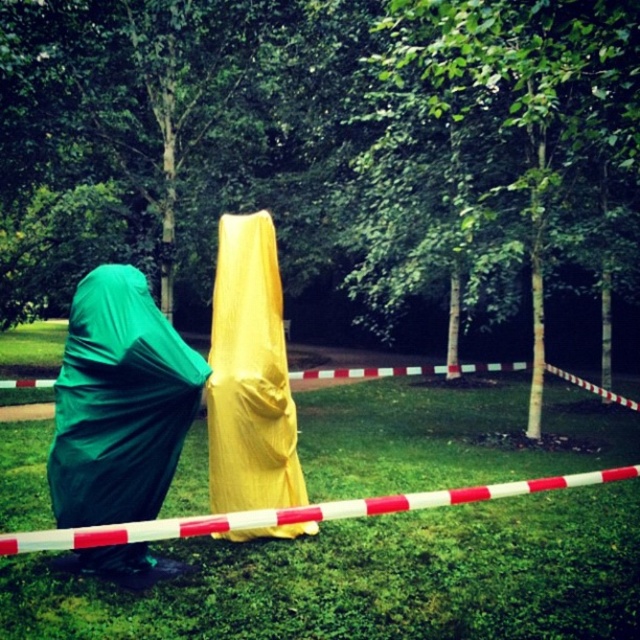
Question: Which of the following is the closest to the observer?

Choices:
 (A) (100, 308)
 (B) (620, 576)
 (C) (227, 248)

Answer: (A)

Question: Based on their relative distances, which object is farther from the green fabric bag at left?

Choices:
 (A) green grass at lower center
 (B) yellow fabric cloak at center

Answer: (A)

Question: Among these objects, which one is nearest to the camera?

Choices:
 (A) green grass at lower center
 (B) green fabric bag at left

Answer: (A)

Question: Does green fabric bag at left lie behind yellow fabric cloak at center?

Choices:
 (A) no
 (B) yes

Answer: (A)

Question: Can you confirm if green grass at lower center is wider than yellow fabric cloak at center?

Choices:
 (A) yes
 (B) no

Answer: (A)

Question: Does green fabric bag at left appear over yellow fabric cloak at center?

Choices:
 (A) no
 (B) yes

Answer: (A)